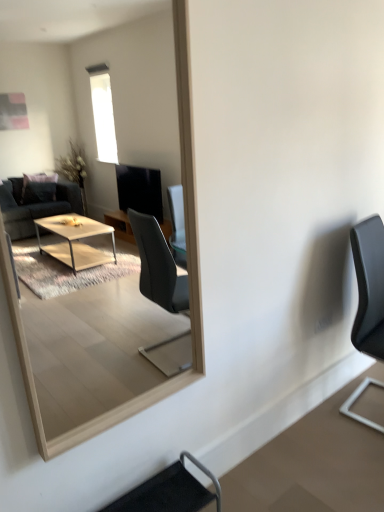
Question: Is black leather chair at lower center, acting as the 1th chair starting from the bottom, surrounding black matte chair at right, arranged as the 2th chair when viewed from the front?

Choices:
 (A) no
 (B) yes

Answer: (A)

Question: Is black leather chair at lower center, the second chair positioned from the right, oriented towards black matte chair at right, arranged as the 2th chair when viewed from the front?

Choices:
 (A) no
 (B) yes

Answer: (A)

Question: Does black leather chair at lower center, the 1th chair when ordered from left to right, have a greater height compared to black matte chair at right, positioned as the 1th chair in top-to-bottom order?

Choices:
 (A) yes
 (B) no

Answer: (B)

Question: Is black leather chair at lower center, acting as the 1th chair starting from the bottom, positioned far away from black matte chair at right, which appears as the second chair when viewed from the left?

Choices:
 (A) yes
 (B) no

Answer: (A)

Question: Is black leather chair at lower center, the second chair positioned from the right, further to the viewer compared to black matte chair at right, arranged as the 2th chair when viewed from the front?

Choices:
 (A) yes
 (B) no

Answer: (B)

Question: Considering the positions of point (369, 295) and point (208, 470), is point (369, 295) closer or farther from the camera than point (208, 470)?

Choices:
 (A) closer
 (B) farther

Answer: (B)

Question: In the image, is black matte chair at right, arranged as the 2th chair when viewed from the front, positioned in front of or behind black leather chair at lower center, the 1th chair when ordered from left to right?

Choices:
 (A) front
 (B) behind

Answer: (B)

Question: From the image's perspective, is black matte chair at right, which appears as the second chair when viewed from the left, located above or below black leather chair at lower center, the 1th chair when ordered from left to right?

Choices:
 (A) below
 (B) above

Answer: (B)

Question: In the image, is black matte chair at right, arranged as the 2th chair when viewed from the front, on the left side or the right side of black leather chair at lower center, acting as the 1th chair starting from the bottom?

Choices:
 (A) left
 (B) right

Answer: (B)

Question: Considering the positions of point tap(8, 301) and point tap(196, 501), is point tap(8, 301) closer or farther from the camera than point tap(196, 501)?

Choices:
 (A) farther
 (B) closer

Answer: (B)

Question: Is wooden frame mirror at center situated inside black leather chair at lower center, the 1th chair when ordered from left to right, or outside?

Choices:
 (A) outside
 (B) inside

Answer: (A)

Question: In the image, is wooden frame mirror at center positioned in front of or behind black leather chair at lower center, marked as the 1th chair in a front-to-back arrangement?

Choices:
 (A) behind
 (B) front

Answer: (B)

Question: Is wooden frame mirror at center taller or shorter than black leather chair at lower center, the second chair from the back?

Choices:
 (A) short
 (B) tall

Answer: (B)

Question: From a real-world perspective, relative to wooden frame mirror at center, is black matte chair at right, acting as the first chair starting from the back, vertically above or below?

Choices:
 (A) above
 (B) below

Answer: (B)

Question: From their relative heights in the image, would you say black matte chair at right, which appears as the second chair when viewed from the left, is taller or shorter than wooden frame mirror at center?

Choices:
 (A) tall
 (B) short

Answer: (B)